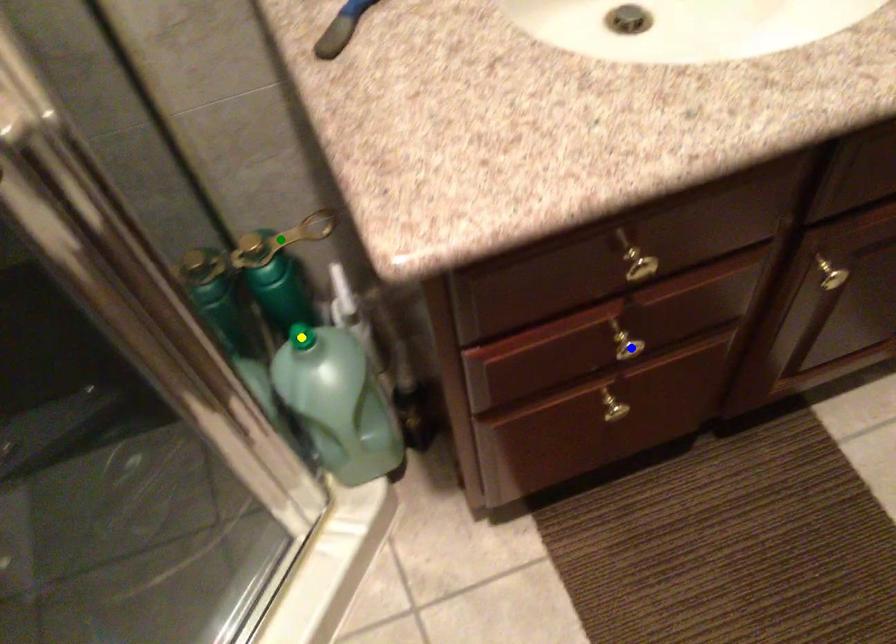
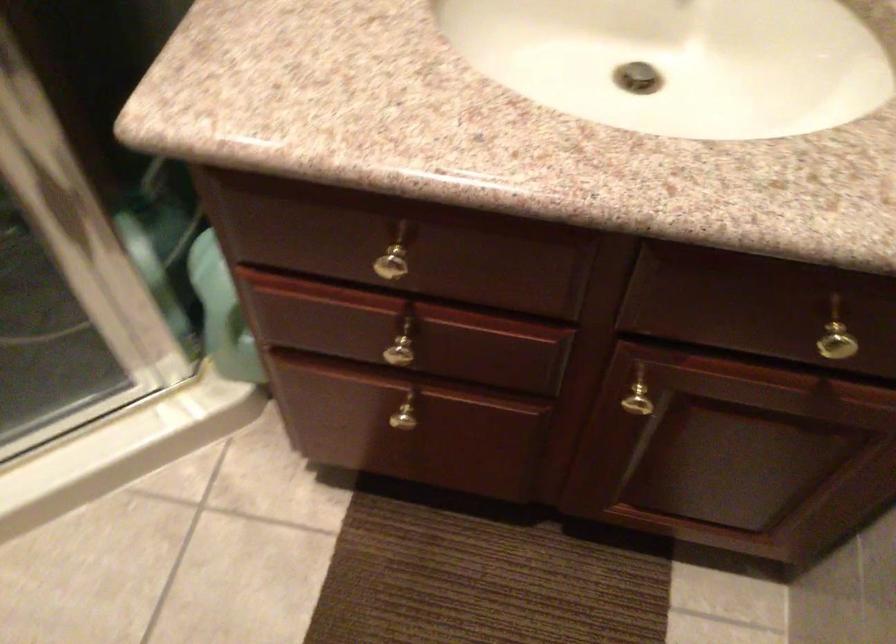
I am providing you with two images of the same scene from different viewpoints. Three points are marked in image1. Which point corresponds to a part or object that is occluded in image2?In image1, three points are marked. Which of them correspond to a part or object that is occluded in image2?Among the three points shown in image1, which one corresponds to a part or object that is no longer visible due to occlusion in image2?

yellow point, green point